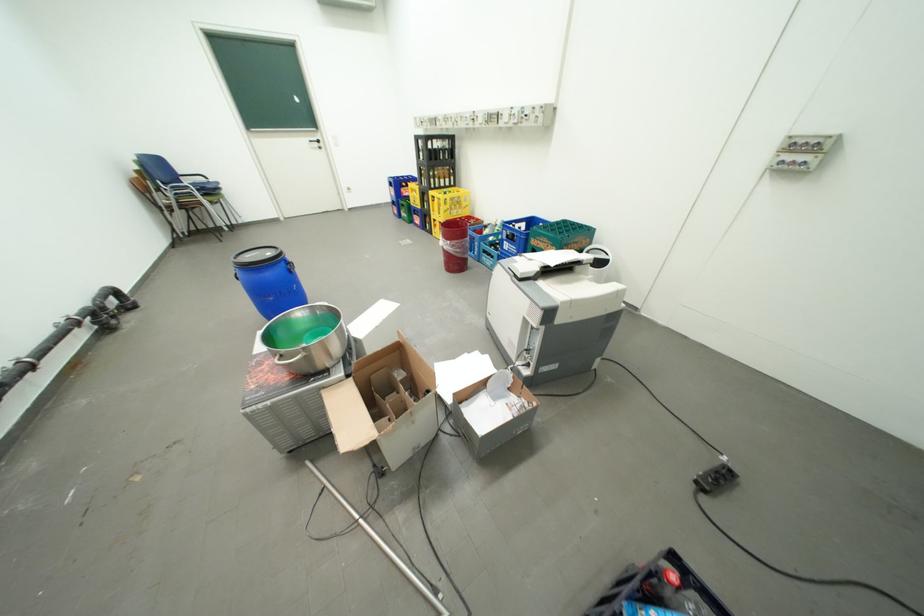
Find where to lift the blue barrel handle. Please return your answer as a coordinate pair (x, y).

(289, 265)